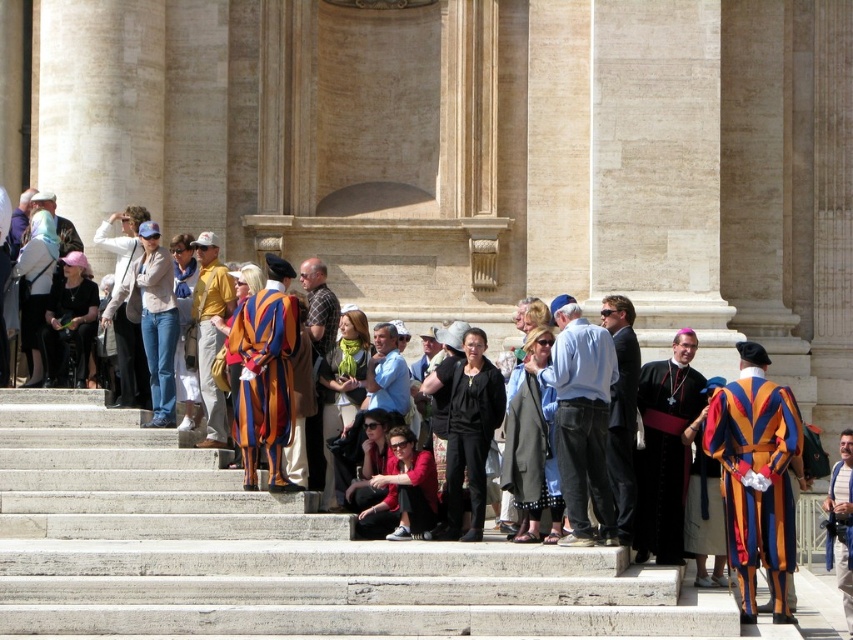
You are a photographer trying to capture a photo of the dark gray suit at center and the multicolored velvet robe at right. Since you want both subjects to appear equally tall in the photo, which subject should you move closer to the camera?

You should move closer to the multicolored velvet robe at right because it is shorter than the dark gray suit at center. By moving closer to it, its image will appear taller in the photo, balancing the sizes of both subjects.

You are a tour guide leading a group of visitors to the entrance of the building. The entrance is located between the multicolored velvet robe at right and the gray wool coat at center. Can you walk directly between them to reach the entrance?

The multicolored velvet robe at right and gray wool coat at center are 4.50 meters apart from each other. Since the entrance is between them, you can walk directly between them to reach the entrance as there is sufficient space.

You are a photographer trying to capture a wide shot of the concrete stairs at center and the matte black robe at center. Which object would you need to frame more carefully due to its narrower width?

The matte black robe at center is narrower than the concrete stairs at center, so you need to frame it more carefully to ensure it fits within the shot.